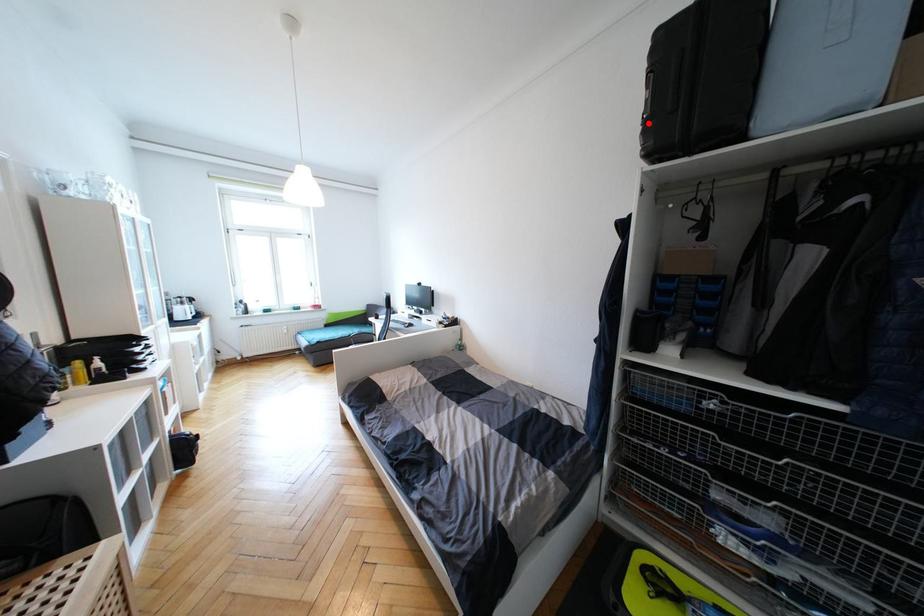
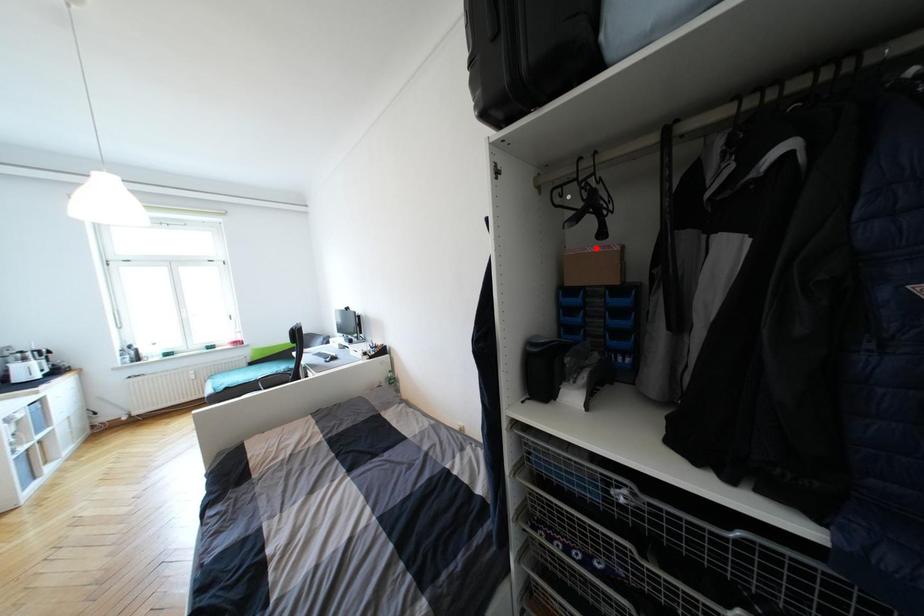
I am providing you with two images of the same scene from different viewpoints. A red point is marked on the first image and another point is marked on the second image. Is the marked point in image1 the same physical position as the marked point in image2?

No